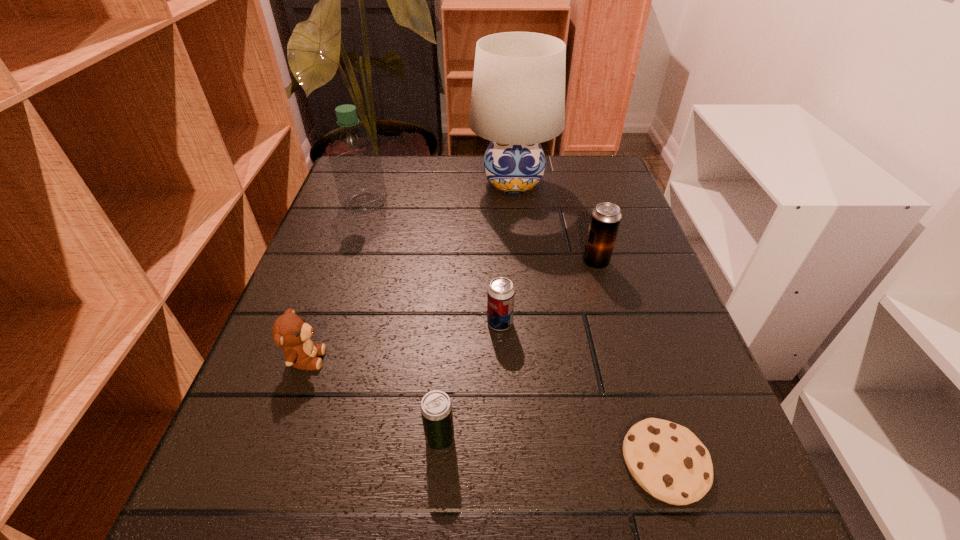
Find the location of a particular element. The height and width of the screenshot is (540, 960). free space at the left edge is located at coordinates (334, 350).

In the image, there is a desktop. Where is `free space at the right edge`? free space at the right edge is located at coordinates (564, 204).

Identify the location of blank space at the far right corner of the desktop. The width and height of the screenshot is (960, 540). (562, 171).

You are a GUI agent. You are given a task and a screenshot of the screen. Output one action in this format:
    pyautogui.click(x=<x>, y=<y>)
    Task: Click on the vacant area at the near right corner
    
    Given the screenshot: What is the action you would take?
    pyautogui.click(x=681, y=521)

You are a GUI agent. You are given a task and a screenshot of the screen. Output one action in this format:
    pyautogui.click(x=<x>, y=<y>)
    Task: Click on the free space between the rightmost beer can and the second beer can from right to left
    
    Given the screenshot: What is the action you would take?
    pyautogui.click(x=548, y=293)

Find the location of `vacant space that is in between the second beer can from left to right and the farthest beer can`. vacant space that is in between the second beer can from left to right and the farthest beer can is located at coordinates (548, 293).

The width and height of the screenshot is (960, 540). What are the coordinates of `free space between the third object from left to right and the second farthest beer can` in the screenshot? It's located at (469, 381).

In order to click on vacant area that lies between the water bottle and the farthest beer can in this screenshot , I will do `click(480, 233)`.

Where is `unoccupied position between the lampshade and the fourth nearest object`? The image size is (960, 540). unoccupied position between the lampshade and the fourth nearest object is located at coordinates (507, 253).

Identify the location of free spot between the tallest object and the cookie. (589, 322).